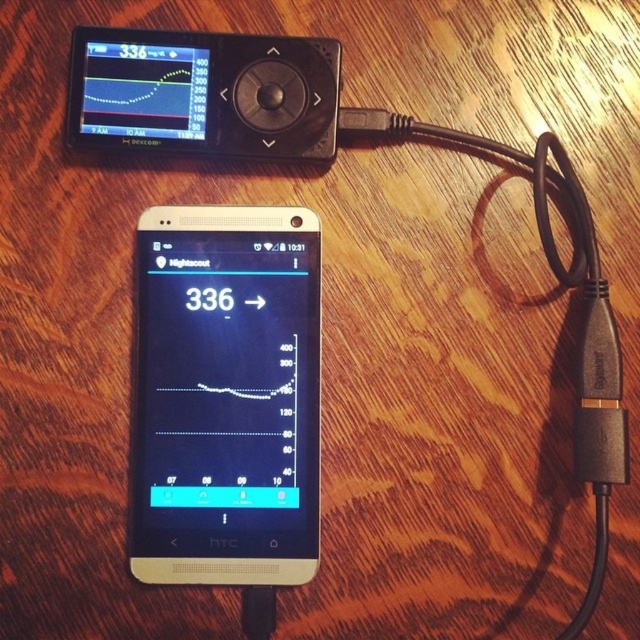
You are holding a matte black phone at center and want to place it on the wooden surface. The matte black device at upper left is already there. Which device will appear larger in the image?

The matte black phone at center will appear larger in the image because it is closer to the viewer than the matte black device at upper left.

You are holding a camera at eye level and want to take a photo of the point marked at coordinates [172,227]. The camera is 1.06 meters away from the point. If the camera has a focal length of 50mm, what is the approximate distance in meters between the camera and the point?

The point marked at coordinates [172,227] is 1.06 meters away from the camera, so the distance between the camera and the point is approximately 1.06 meters.

You are a diabetes patient who needs to check your glucose levels. You have a matte black device at upper left and a black rubber cable at lower right on your desk. Which device should you use to monitor your glucose levels?

The matte black device at upper left is the one you should use to monitor your glucose levels because it is the Dexcom device with a screen displaying glucose levels, while the black rubber cable at lower right is likely a cable for connecting to another device.